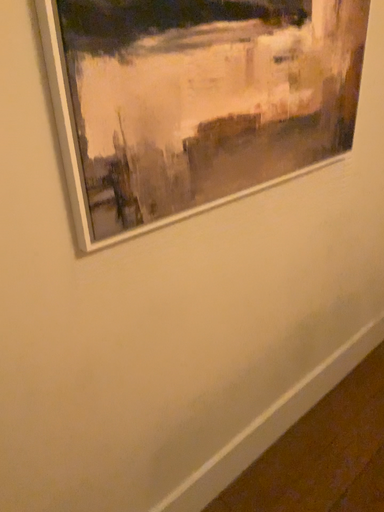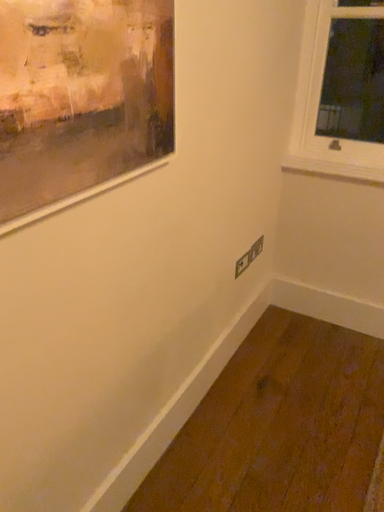
Question: How did the camera likely rotate when shooting the video?

Choices:
 (A) rotated left
 (B) rotated right

Answer: (B)